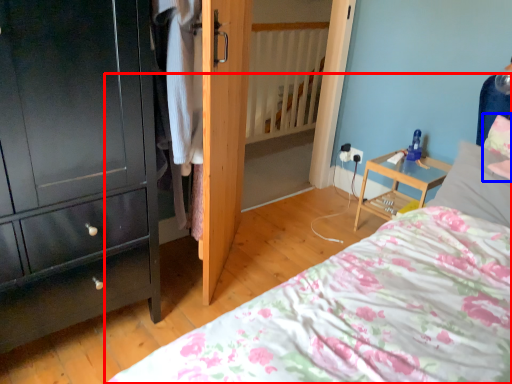
Question: Which object is closer to the camera taking this photo, bed (highlighted by a red box) or pillow (highlighted by a blue box)?

Choices:
 (A) bed
 (B) pillow

Answer: (A)